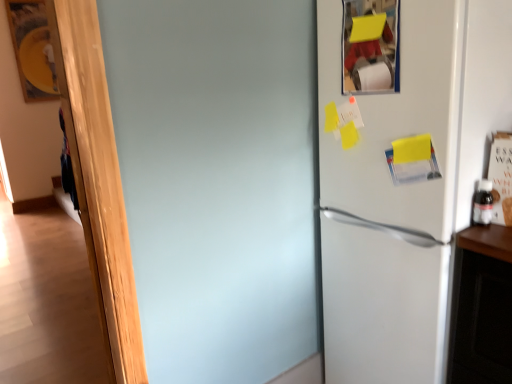
Question: Is point (480, 223) closer or farther from the camera than point (380, 372)?

Choices:
 (A) farther
 (B) closer

Answer: (B)

Question: Is transparent plastic bottle at right to the left or to the right of white matte refrigerator at right in the image?

Choices:
 (A) left
 (B) right

Answer: (B)

Question: Considering the positions of transparent plastic bottle at right and white matte refrigerator at right in the image, is transparent plastic bottle at right bigger or smaller than white matte refrigerator at right?

Choices:
 (A) small
 (B) big

Answer: (A)

Question: From the image's perspective, is white matte refrigerator at right located above or below transparent plastic bottle at right?

Choices:
 (A) below
 (B) above

Answer: (A)

Question: Choose the correct answer: Is white matte refrigerator at right inside transparent plastic bottle at right or outside it?

Choices:
 (A) inside
 (B) outside

Answer: (B)

Question: Considering their positions, is white matte refrigerator at right located in front of or behind transparent plastic bottle at right?

Choices:
 (A) behind
 (B) front

Answer: (B)

Question: Looking at their shapes, would you say white matte refrigerator at right is wider or thinner than transparent plastic bottle at right?

Choices:
 (A) wide
 (B) thin

Answer: (A)